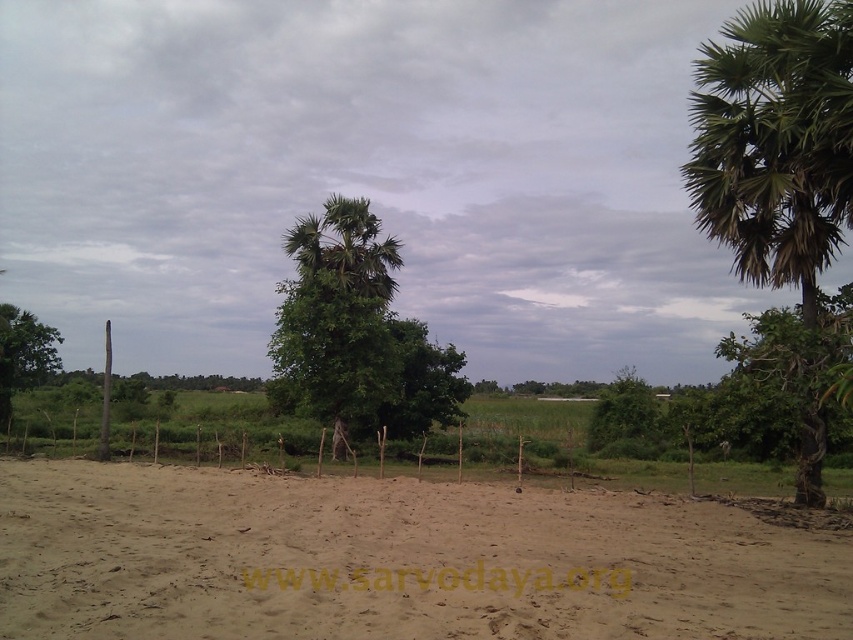
Question: Does green leafy tree at center lie behind green leafy tree at left?

Choices:
 (A) yes
 (B) no

Answer: (B)

Question: Does green leafy tree at center have a lesser width compared to green leafy tree at left?

Choices:
 (A) yes
 (B) no

Answer: (B)

Question: Which of the following is the closest to the observer?

Choices:
 (A) green leafy tree at left
 (B) green leafy tree at center
 (C) brown sandy dirt field at center

Answer: (C)

Question: Does green leafy palm tree at right appear on the right side of green leafy tree at center?

Choices:
 (A) no
 (B) yes

Answer: (B)

Question: Estimate the real-world distances between objects in this image. Which object is closer to the green leafy tree at center?

Choices:
 (A) green leafy palm tree at right
 (B) green leafy tree at left
 (C) brown sandy dirt field at center

Answer: (B)

Question: Which of the following is the closest to the observer?

Choices:
 (A) (61, 337)
 (B) (351, 413)

Answer: (B)